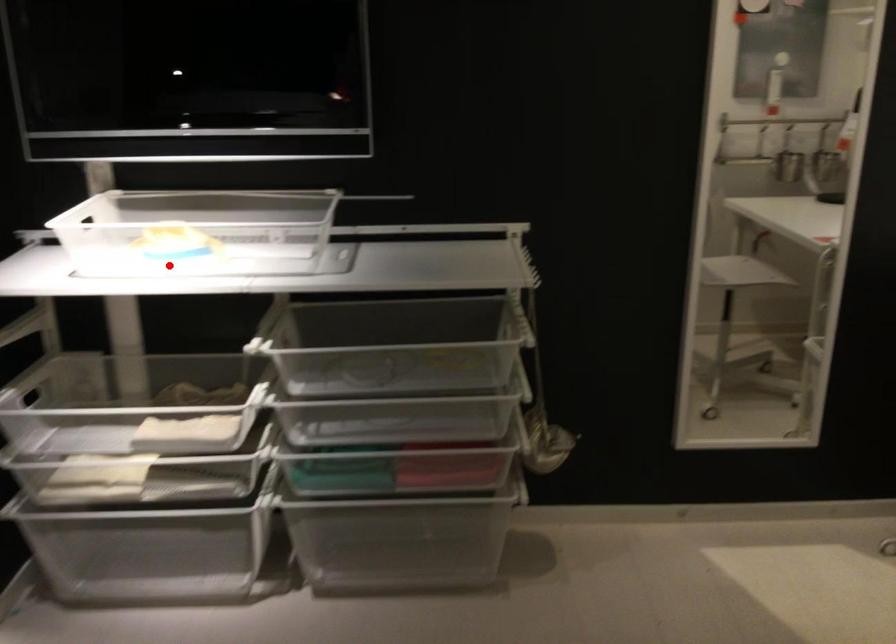
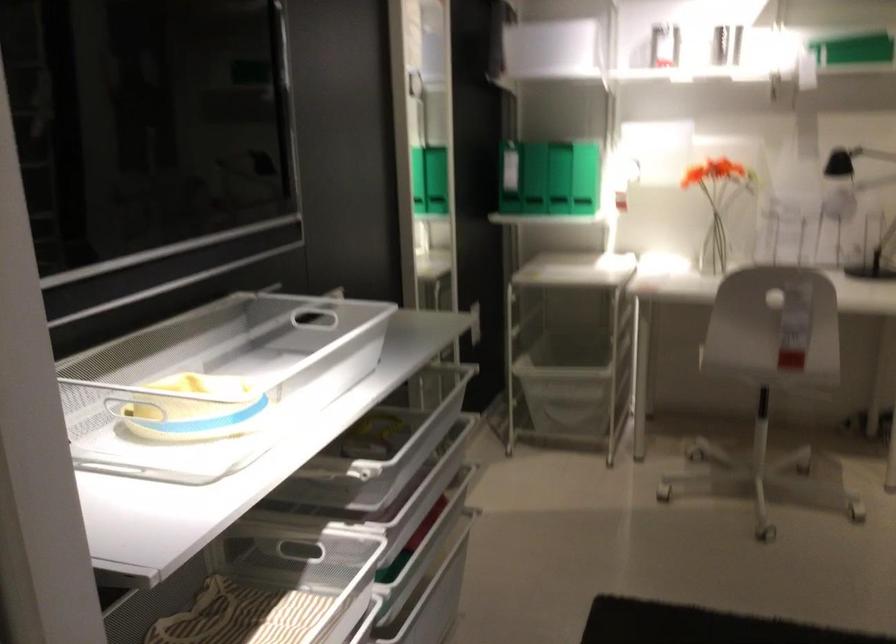
Question: A red point is marked in image1. In image2, is the corresponding 3D point closer to the camera or farther? Reply with the corresponding letter.

Choices:
 (A) The corresponding 3D point is closer.
 (B) The corresponding 3D point is farther.

Answer: (A)